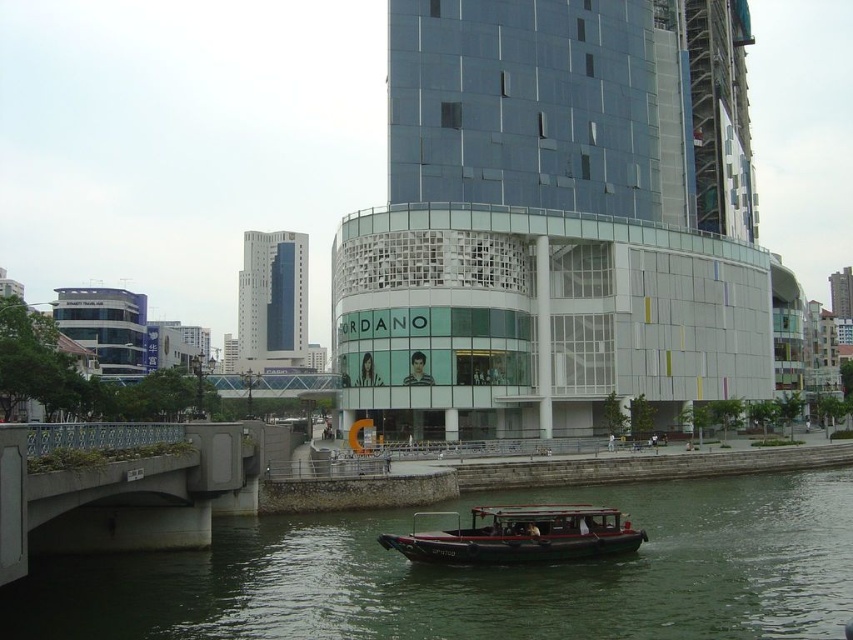
Question: Estimate the real-world distances between objects in this image. Which object is farther from the dark brown wood boat at center?

Choices:
 (A) glassy metallic building at center
 (B) concrete bridge at lower left

Answer: (A)

Question: Is concrete bridge at lower left above glassy blue skyscraper at upper left?

Choices:
 (A) yes
 (B) no

Answer: (B)

Question: Does glassy metallic building at center have a greater width compared to glassy blue skyscraper at upper left?

Choices:
 (A) no
 (B) yes

Answer: (B)

Question: Which object is closer to the camera taking this photo?

Choices:
 (A) greenish water at lower center
 (B) glassy blue skyscraper at upper left
 (C) dark brown wood boat at center
 (D) glassy metallic building at center

Answer: (A)

Question: Which point is closer to the camera?

Choices:
 (A) (457, 525)
 (B) (292, 308)
 (C) (230, 486)

Answer: (C)

Question: Can you confirm if concrete bridge at lower left is positioned to the right of glassy blue skyscraper at upper left?

Choices:
 (A) yes
 (B) no

Answer: (A)